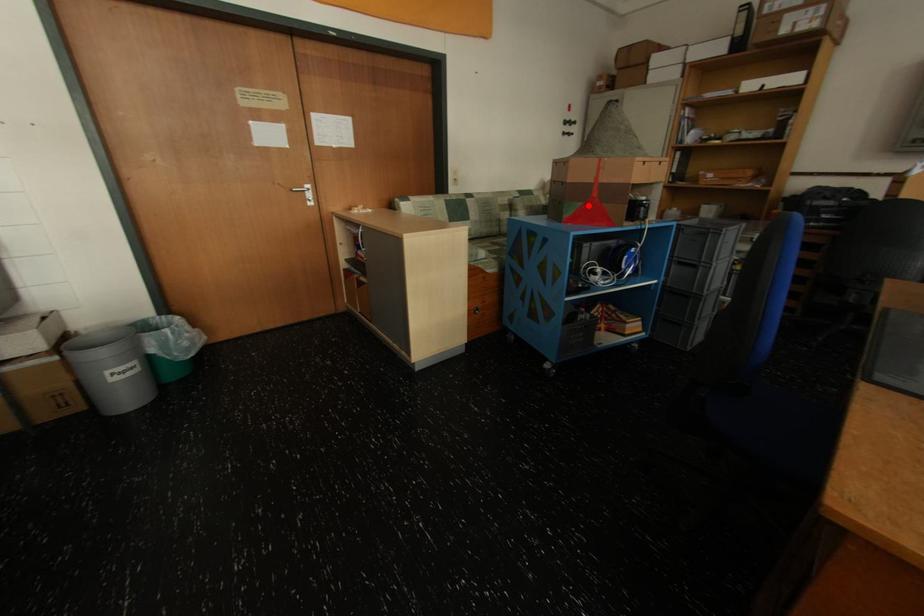
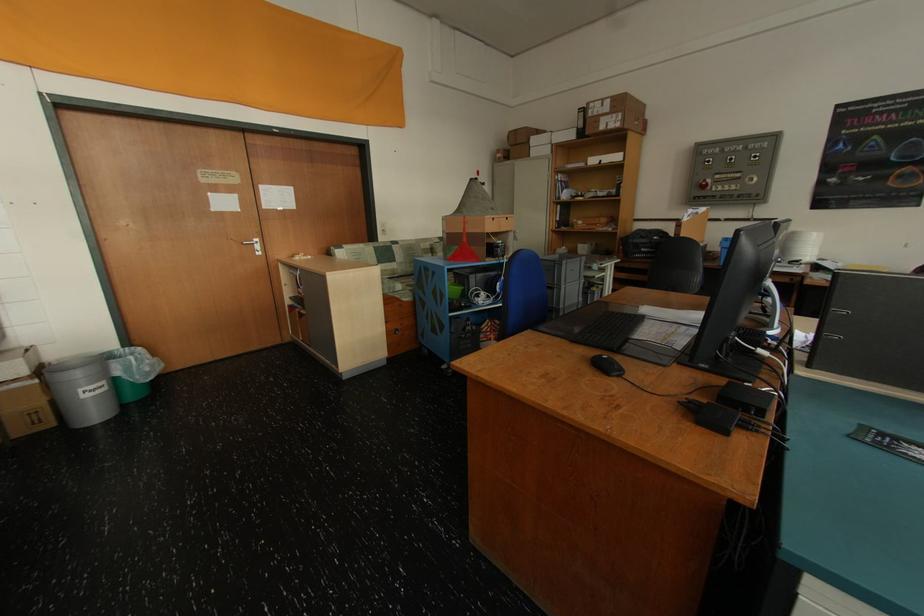
Find the pixel in the second image that matches the highlighted location in the first image.

(465, 249)